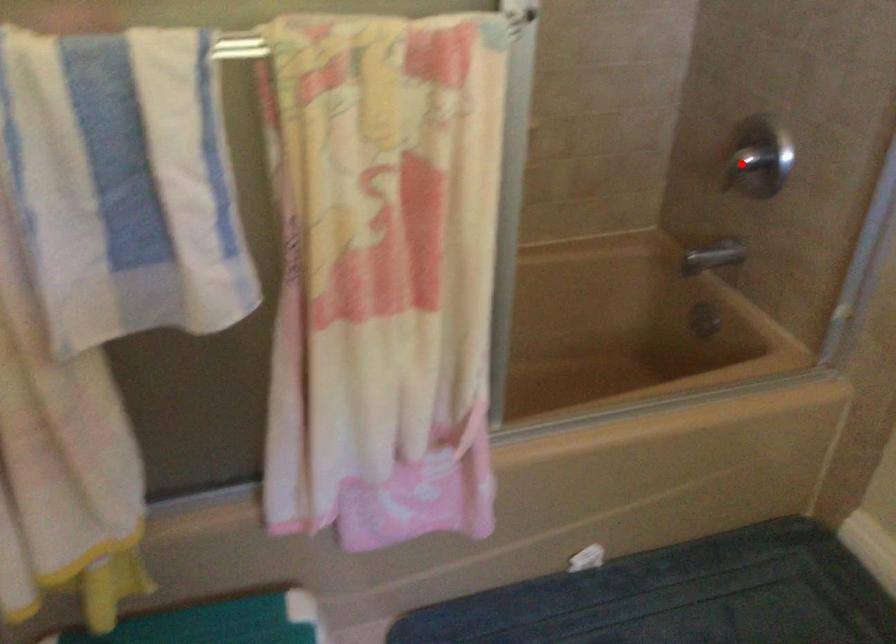
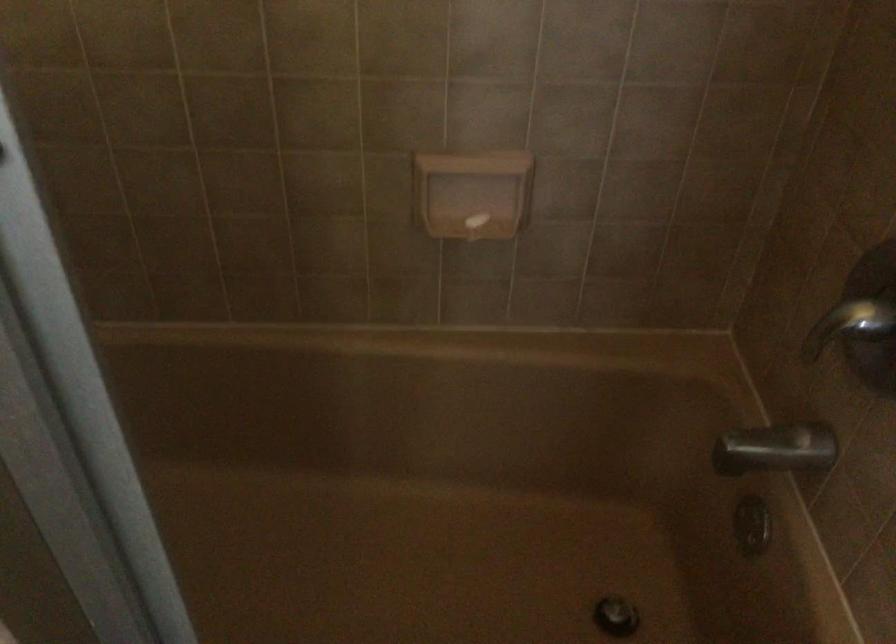
Find the pixel in the second image that matches the highlighted location in the first image.

(849, 325)